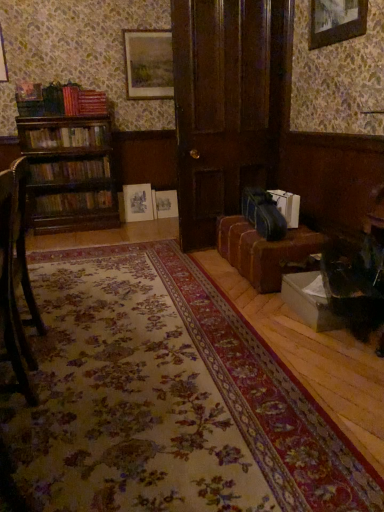
Identify the location of vacant area on top of hardcover books at left, arranged as the second book when viewed from the front (from a real-world perspective). The width and height of the screenshot is (384, 512). (71, 125).